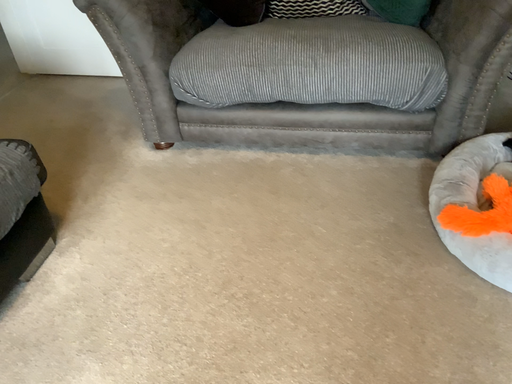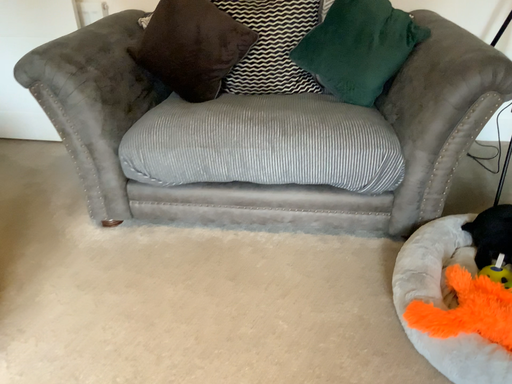
Question: How did the camera likely rotate when shooting the video?

Choices:
 (A) rotated upward
 (B) rotated downward

Answer: (A)